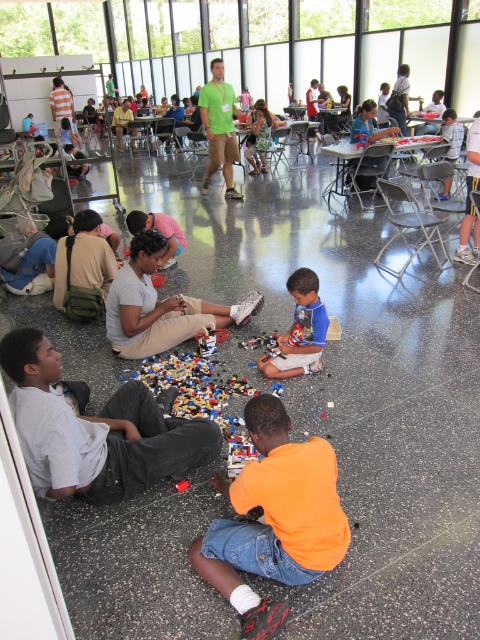
Is the position of gray cotton pants at lower left less distant than that of orange matte shirt at lower center?

No, it is behind orange matte shirt at lower center.

Can you confirm if gray cotton pants at lower left is positioned below orange matte shirt at lower center?

No, gray cotton pants at lower left is not below orange matte shirt at lower center.

Describe the element at coordinates (95, 429) in the screenshot. I see `gray cotton pants at lower left` at that location.

Where is `gray cotton pants at lower left`? gray cotton pants at lower left is located at coordinates (95, 429).

Can you confirm if orange matte shirt at lower center is shorter than blue matte shirt at center?

Incorrect, orange matte shirt at lower center's height does not fall short of blue matte shirt at center's.

Who is more forward, (310, 509) or (320, 323)?

Positioned in front is point (310, 509).

Locate an element on the screen. The height and width of the screenshot is (640, 480). orange matte shirt at lower center is located at coordinates (275, 516).

The height and width of the screenshot is (640, 480). What are the coordinates of `gray cotton pants at lower left` in the screenshot? It's located at (95, 429).

Which is behind, point (47, 492) or point (301, 289)?

The point (301, 289) is behind.

Image resolution: width=480 pixels, height=640 pixels. What are the coordinates of `gray cotton pants at lower left` in the screenshot? It's located at (95, 429).